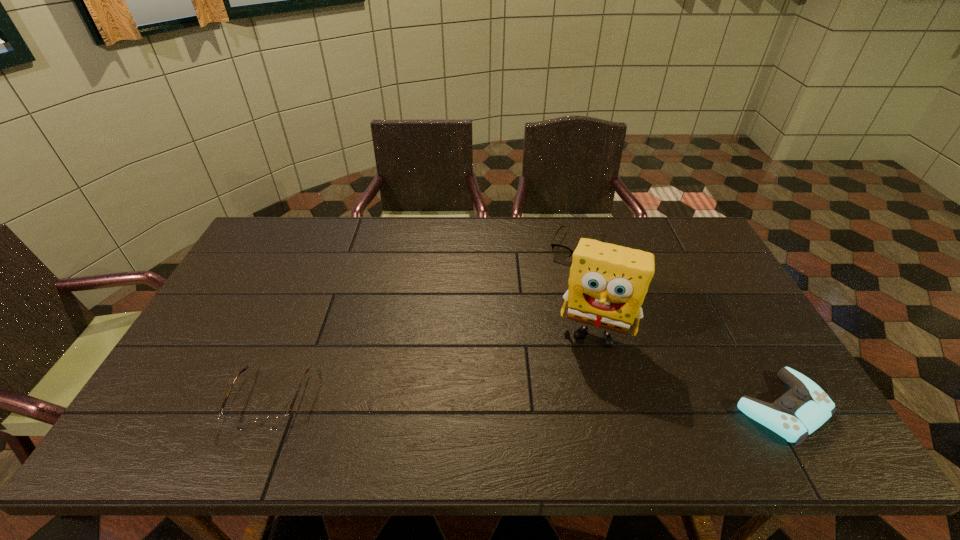
Where is `free space between the control and the tallest object`? The width and height of the screenshot is (960, 540). free space between the control and the tallest object is located at coordinates (688, 369).

Locate an element on the screen. This screenshot has width=960, height=540. blank region between the rightmost object and the tallest object is located at coordinates (688, 369).

The height and width of the screenshot is (540, 960). What are the coordinates of `unoccupied position between the tallest object and the control` in the screenshot? It's located at (688, 369).

The width and height of the screenshot is (960, 540). Identify the location of free space between the control and the leftmost object. (526, 404).

Where is `vacant area that lies between the farther spectacles and the nearer spectacles`? This screenshot has width=960, height=540. vacant area that lies between the farther spectacles and the nearer spectacles is located at coordinates (423, 324).

You are a GUI agent. You are given a task and a screenshot of the screen. Output one action in this format:
    pyautogui.click(x=<x>, y=<y>)
    Task: Click on the vacant area that lies between the nearer spectacles and the tallest object
    The image size is (960, 540).
    Given the screenshot: What is the action you would take?
    pyautogui.click(x=433, y=365)

Image resolution: width=960 pixels, height=540 pixels. What are the coordinates of `free area in between the nearer spectacles and the second farthest object` in the screenshot? It's located at pyautogui.click(x=433, y=365).

At what (x,y) coordinates should I click in order to perform the action: click on vacant point located between the second farthest object and the rightmost object. Please return your answer as a coordinate pair (x, y). The height and width of the screenshot is (540, 960). Looking at the image, I should click on (688, 369).

You are a GUI agent. You are given a task and a screenshot of the screen. Output one action in this format:
    pyautogui.click(x=<x>, y=<y>)
    Task: Click on the object that is the closest to the right spectacles
    The height and width of the screenshot is (540, 960).
    Given the screenshot: What is the action you would take?
    pyautogui.click(x=607, y=284)

Point out which object is positioned as the nearest to the right spectacles. Please provide its 2D coordinates. Your answer should be formatted as a tuple, i.e. [(x, y)], where the tuple contains the x and y coordinates of a point satisfying the conditions above.

[(607, 284)]